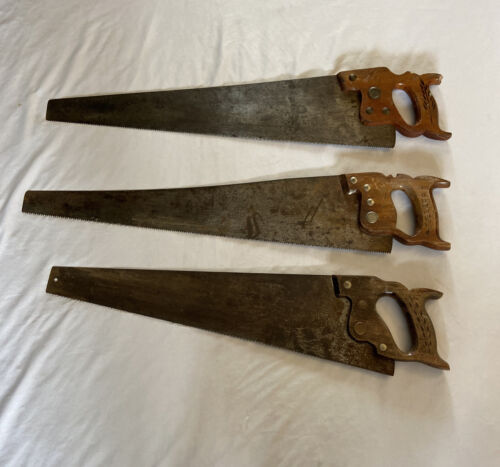
Where is `screws`? The width and height of the screenshot is (500, 467). screws is located at coordinates (370, 197), (365, 185), (355, 179), (361, 299), (347, 284), (368, 110), (378, 107), (376, 98), (354, 79).